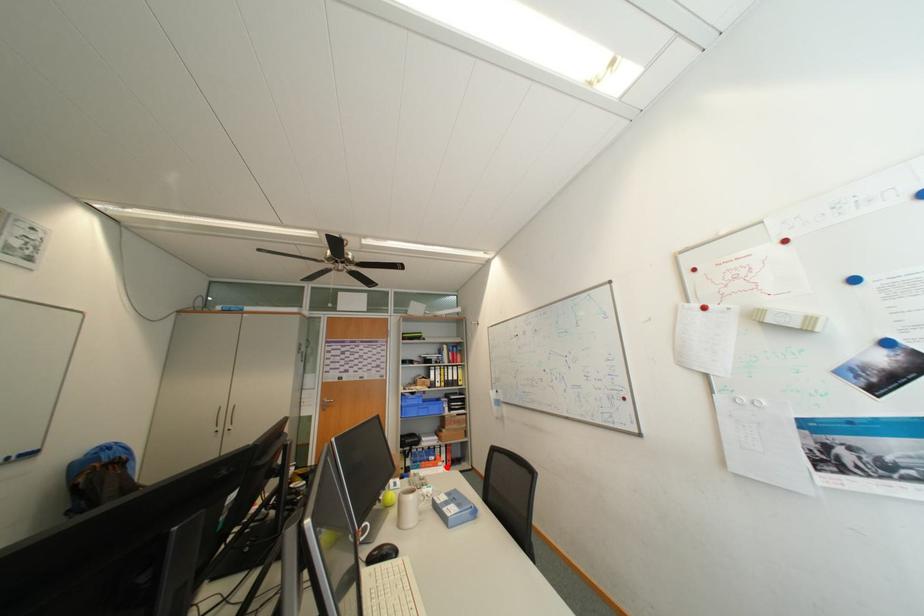
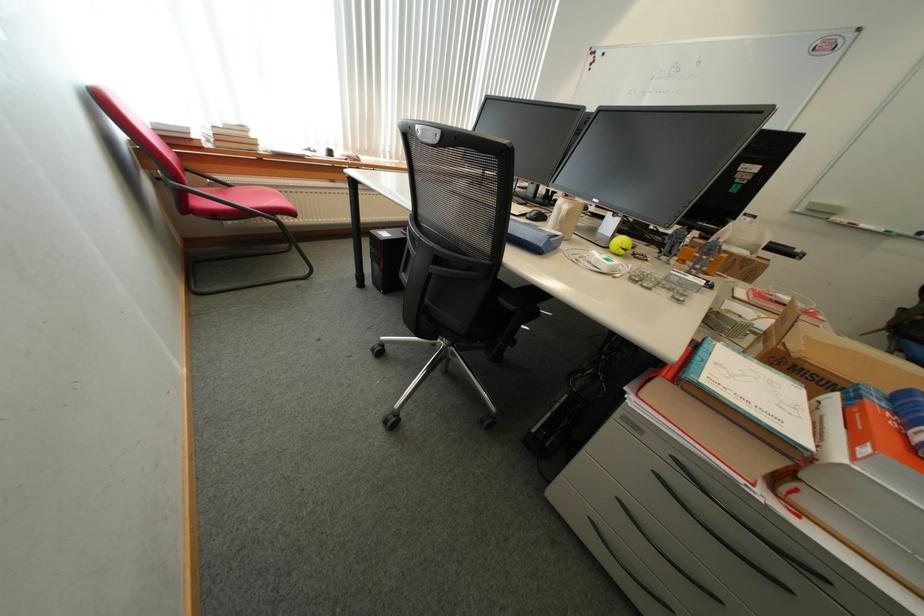
Question: I am providing you with two images of the same scene from different viewpoints. A red point is shown in image1. For the corresponding object point in image2, is it positioned nearer or farther from the camera?

Choices:
 (A) Nearer
 (B) Farther

Answer: (B)